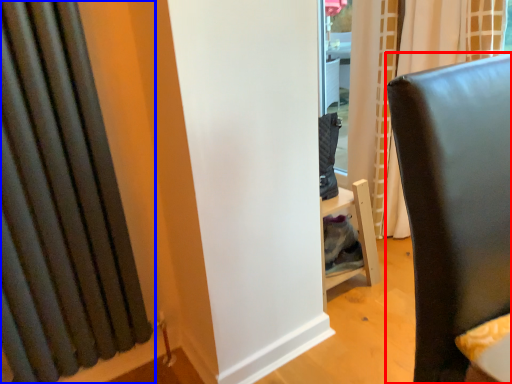
Question: Which of the following is the farthest to the observer, furniture (highlighted by a red box) or curtain (highlighted by a blue box)?

Choices:
 (A) furniture
 (B) curtain

Answer: (B)